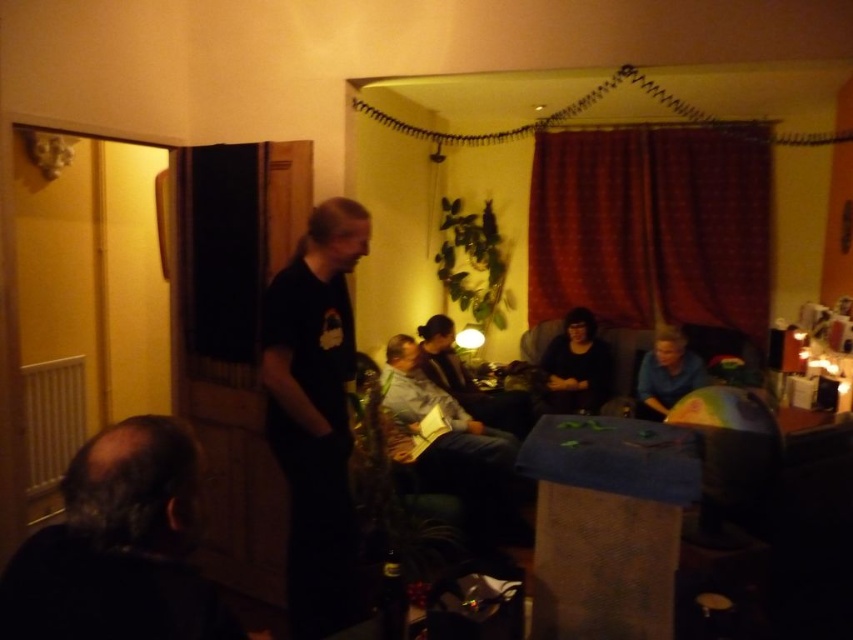
Can you confirm if denim jacket at center is positioned to the left of dark gray shirt at center?

Yes, denim jacket at center is to the left of dark gray shirt at center.

Which is more to the left, denim jacket at center or dark gray shirt at center?

denim jacket at center

Identify the location of denim jacket at center. [x=456, y=449].

What do you see at coordinates (315, 412) in the screenshot? I see `black matte shirt at left` at bounding box center [315, 412].

Does black matte shirt at left appear on the left side of dark gray shirt at center?

Yes, black matte shirt at left is to the left of dark gray shirt at center.

This screenshot has height=640, width=853. Find the location of `black matte shirt at left`. black matte shirt at left is located at coordinates (315, 412).

Can you confirm if dark hair at lower left is shorter than denim jacket at center?

Indeed, dark hair at lower left has a lesser height compared to denim jacket at center.

Measure the distance between point (142, 484) and camera.

A distance of 1.07 meters exists between point (142, 484) and camera.

Find the location of a particular element. dark hair at lower left is located at coordinates (119, 547).